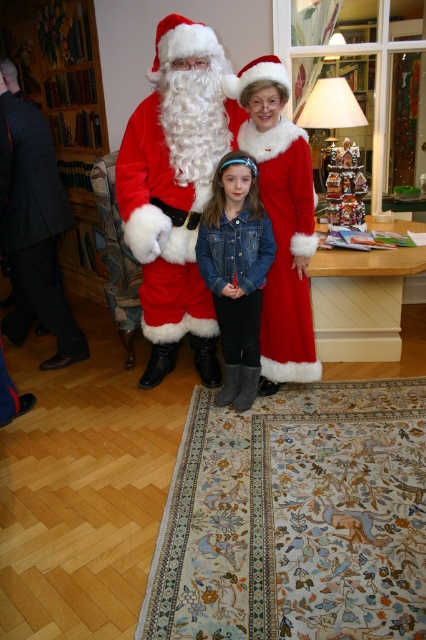
Question: Which point appears closest to the camera in this image?

Choices:
 (A) (265, 374)
 (B) (75, 330)
 (C) (126, 198)
 (D) (224, 336)

Answer: (C)

Question: Does dark gray suit at left come in front of velvet red dress at center?

Choices:
 (A) no
 (B) yes

Answer: (A)

Question: Which of the following is the closest to the observer?

Choices:
 (A) (233, 189)
 (B) (3, 83)
 (C) (161, 225)

Answer: (A)

Question: Is velvet red dress at center bigger than denim jacket at center?

Choices:
 (A) yes
 (B) no

Answer: (A)

Question: Does velvet red dress at center come behind denim jacket at center?

Choices:
 (A) yes
 (B) no

Answer: (A)

Question: Among these points, which one is farthest from the camera?

Choices:
 (A) (313, 209)
 (B) (204, 278)
 (C) (32, 276)
 (D) (172, 104)

Answer: (C)